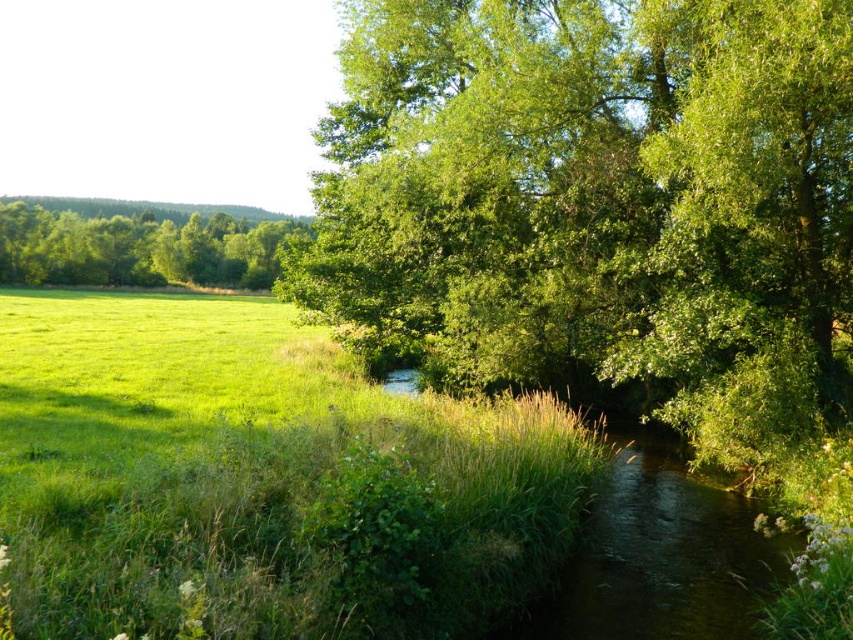
Does green leafy tree at center appear on the left side of green leafy tree at left?

In fact, green leafy tree at center is to the right of green leafy tree at left.

Is green leafy tree at center bigger than green leafy tree at left?

No, green leafy tree at center is not bigger than green leafy tree at left.

I want to click on green leafy tree at center, so click(x=604, y=214).